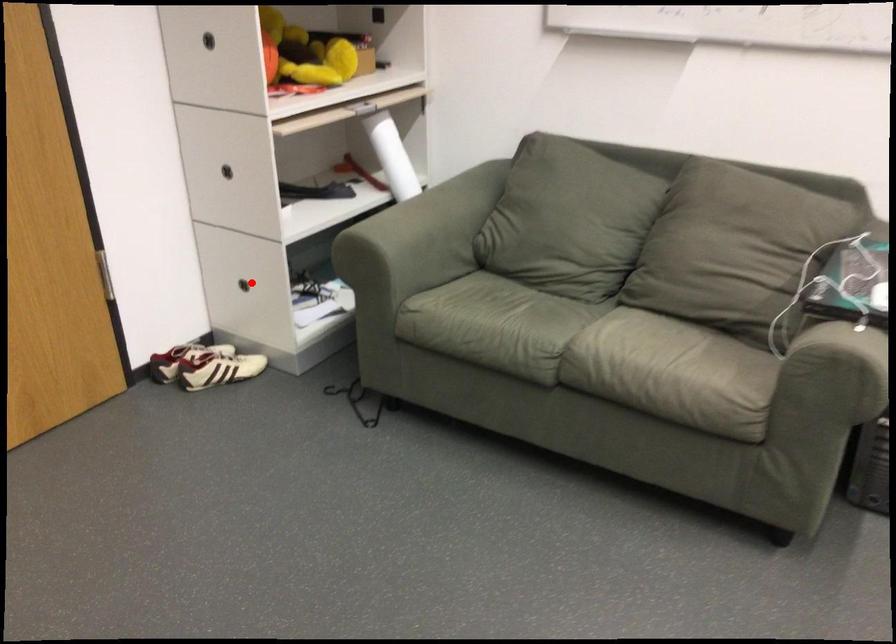
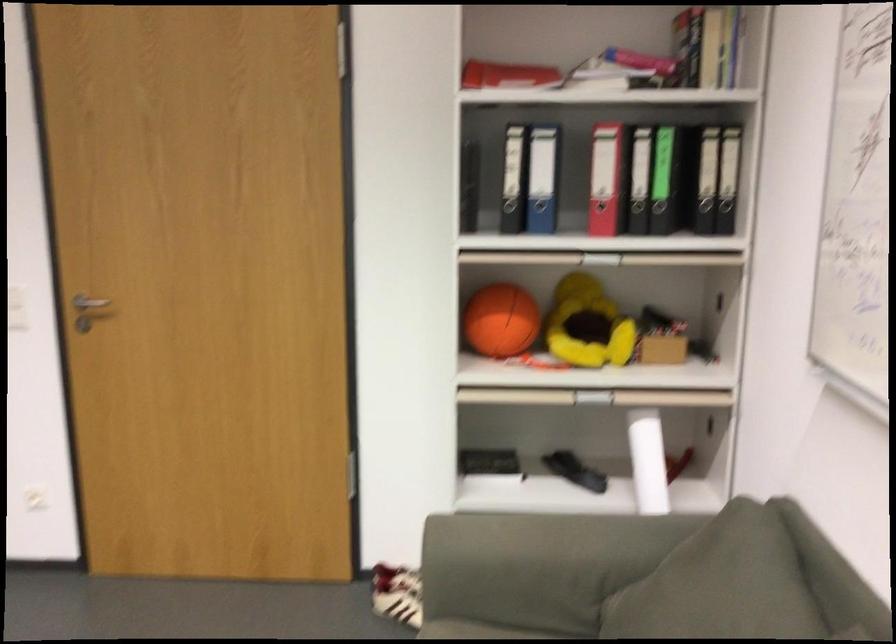
Question: I am providing you with two images of the same scene from different viewpoints. A red point is marked on the first image. Can you still see the location of the red point in image 2?

Choices:
 (A) Yes
 (B) No

Answer: (B)